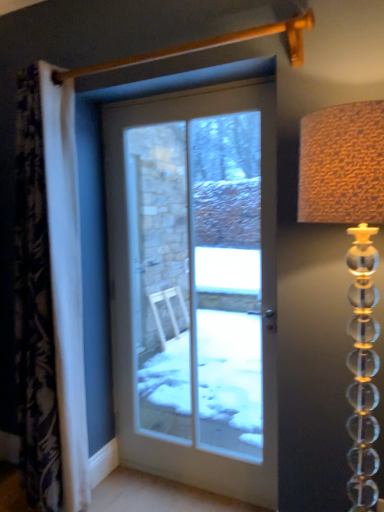
Question: From a real-world perspective, does white glass door at center sit lower than translucent glass lampshade at right?

Choices:
 (A) yes
 (B) no

Answer: (A)

Question: Is white glass door at center oriented towards translucent glass lampshade at right?

Choices:
 (A) yes
 (B) no

Answer: (B)

Question: From the image's perspective, is white glass door at center located beneath translucent glass lampshade at right?

Choices:
 (A) yes
 (B) no

Answer: (B)

Question: Is white glass door at center thinner than translucent glass lampshade at right?

Choices:
 (A) yes
 (B) no

Answer: (A)

Question: From the image's perspective, does white glass door at center appear higher than translucent glass lampshade at right?

Choices:
 (A) no
 (B) yes

Answer: (B)

Question: From the image's perspective, is white fabric curtain at left positioned above or below translucent glass lampshade at right?

Choices:
 (A) above
 (B) below

Answer: (A)

Question: Choose the correct answer: Is white fabric curtain at left inside translucent glass lampshade at right or outside it?

Choices:
 (A) inside
 (B) outside

Answer: (B)

Question: Based on their sizes in the image, would you say white fabric curtain at left is bigger or smaller than translucent glass lampshade at right?

Choices:
 (A) big
 (B) small

Answer: (A)

Question: Is white fabric curtain at left in front of or behind translucent glass lampshade at right in the image?

Choices:
 (A) front
 (B) behind

Answer: (B)

Question: Looking at their shapes, would you say white glass door at center is wider or thinner than white fabric curtain at left?

Choices:
 (A) thin
 (B) wide

Answer: (A)

Question: Does point (130, 330) appear closer or farther from the camera than point (46, 350)?

Choices:
 (A) farther
 (B) closer

Answer: (A)

Question: Is white glass door at center bigger or smaller than white fabric curtain at left?

Choices:
 (A) small
 (B) big

Answer: (A)

Question: From the image's perspective, is white glass door at center positioned above or below white fabric curtain at left?

Choices:
 (A) above
 (B) below

Answer: (B)

Question: In the image, is white fabric curtain at left on the left side or the right side of white glass door at center?

Choices:
 (A) left
 (B) right

Answer: (A)

Question: Looking at their shapes, would you say white fabric curtain at left is wider or thinner than white glass door at center?

Choices:
 (A) thin
 (B) wide

Answer: (B)